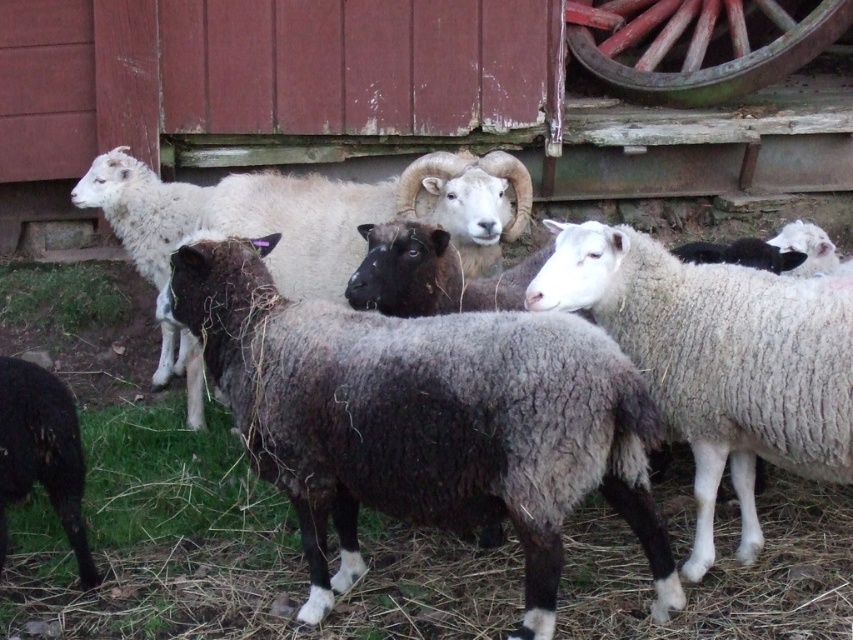
Question: Which object appears closest to the camera in this image?

Choices:
 (A) dark gray woolly sheep at center
 (B) rustic wood wagon wheel at upper right
 (C) white woolly sheep at center

Answer: (C)

Question: Which object appears farthest from the camera in this image?

Choices:
 (A) rustic wood wagon wheel at upper right
 (B) white woolly sheep at center

Answer: (A)

Question: Which object is positioned farthest from the dark gray woolly sheep at center?

Choices:
 (A) white woolly sheep at center
 (B) green fuzzy grass at lower left

Answer: (B)

Question: Is dark gray woolly sheep at center to the left of rustic wood wagon wheel at upper right from the viewer's perspective?

Choices:
 (A) no
 (B) yes

Answer: (B)

Question: Does dark gray woolly sheep at center appear under white woolly sheep at center?

Choices:
 (A) yes
 (B) no

Answer: (A)

Question: Does rustic wood wagon wheel at upper right come in front of green fuzzy grass at lower left?

Choices:
 (A) yes
 (B) no

Answer: (B)